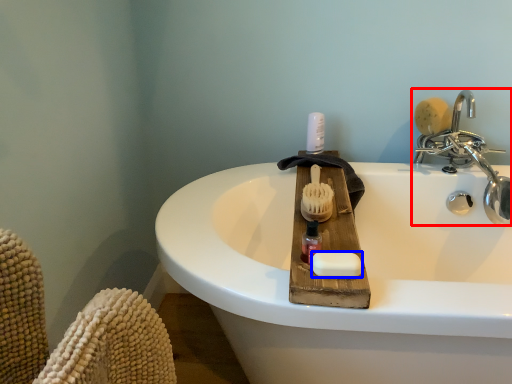
Question: Which object is further to the camera taking this photo, tap (highlighted by a red box) or soap (highlighted by a blue box)?

Choices:
 (A) tap
 (B) soap

Answer: (A)